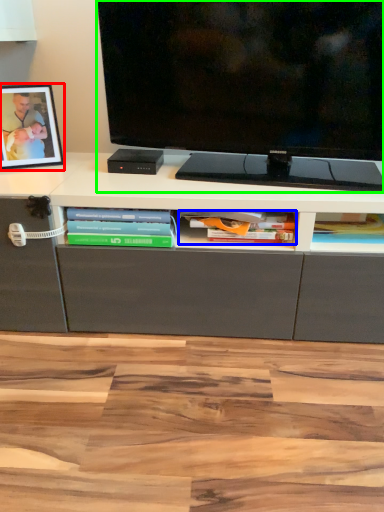
Question: Which object is positioned farthest from picture frame (highlighted by a red box)? Select from book (highlighted by a blue box) and television (highlighted by a green box).

Choices:
 (A) book
 (B) television

Answer: (A)